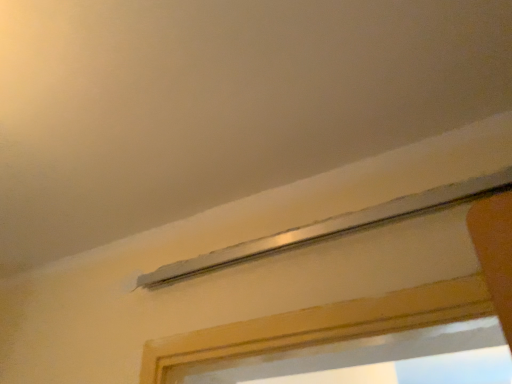
Question: Should I look upward or downward to see wooden frame at bottom right?

Choices:
 (A) up
 (B) down

Answer: (B)